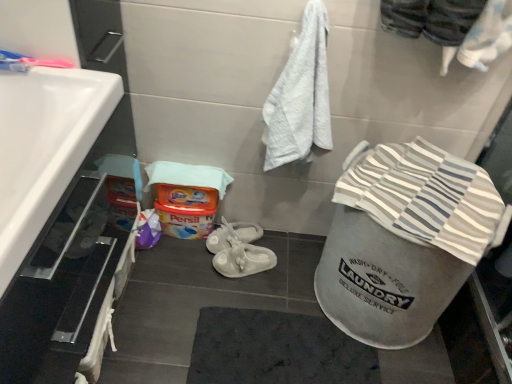
Locate an element on the screen. vacant point to the left of white rubber sandals at center is located at coordinates (194, 270).